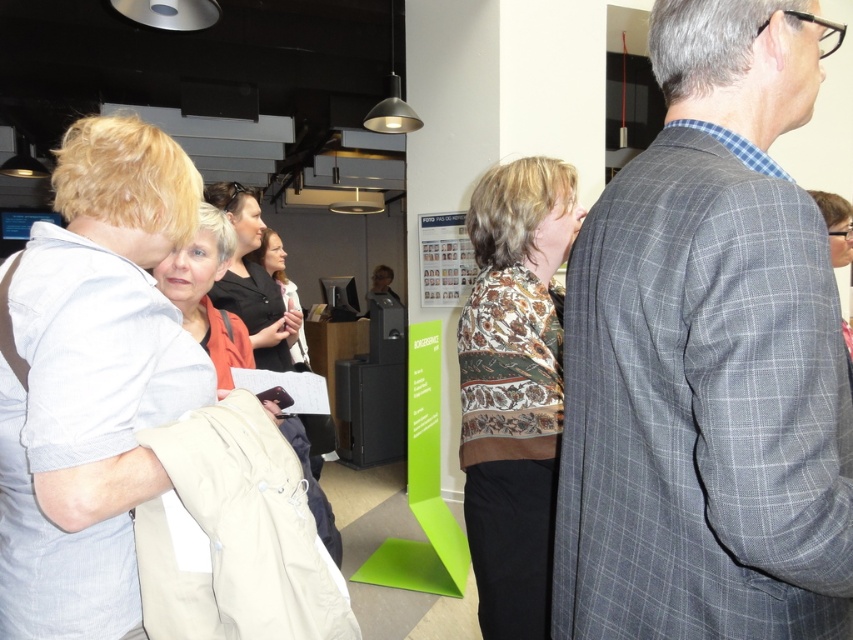
Question: Which of the following is the farthest from the observer?

Choices:
 (A) (281, 364)
 (B) (258, 250)

Answer: (B)

Question: Is gray checkered suit at right closer to camera compared to black fabric jacket at center?

Choices:
 (A) no
 (B) yes

Answer: (B)

Question: Does gray checkered suit at right lie in front of printed fabric blouse at center?

Choices:
 (A) yes
 (B) no

Answer: (A)

Question: Considering the real-world distances, which object is farthest from the matte beige coat at center?

Choices:
 (A) printed fabric blouse at center
 (B) gray checkered suit at right

Answer: (B)

Question: Can you confirm if gray checkered suit at right is thinner than matte orange shirt at center?

Choices:
 (A) yes
 (B) no

Answer: (A)

Question: Which object is the farthest from the matte beige coat at center?

Choices:
 (A) matte orange shirt at center
 (B) matte black laptop at center
 (C) printed fabric blouse at center
 (D) gray checkered suit at right

Answer: (B)